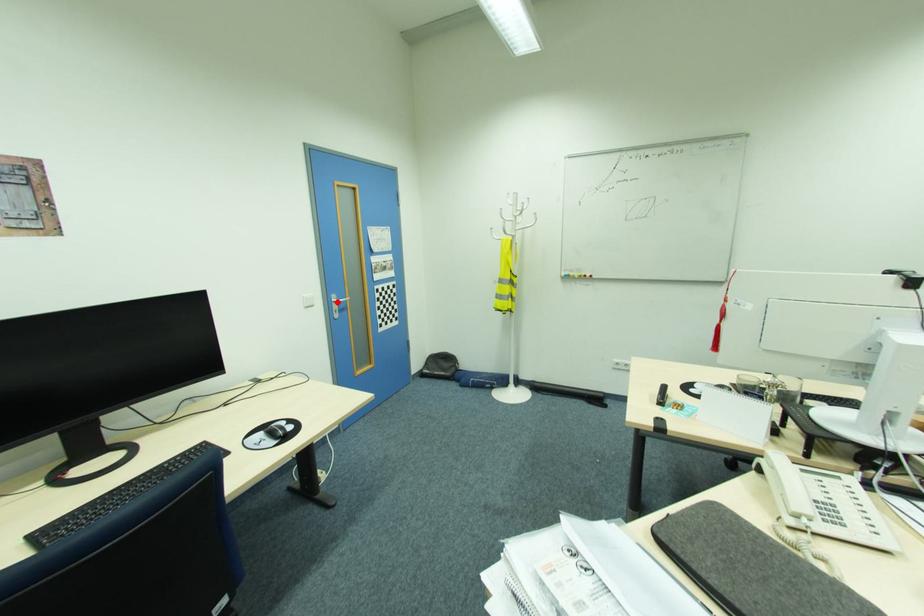
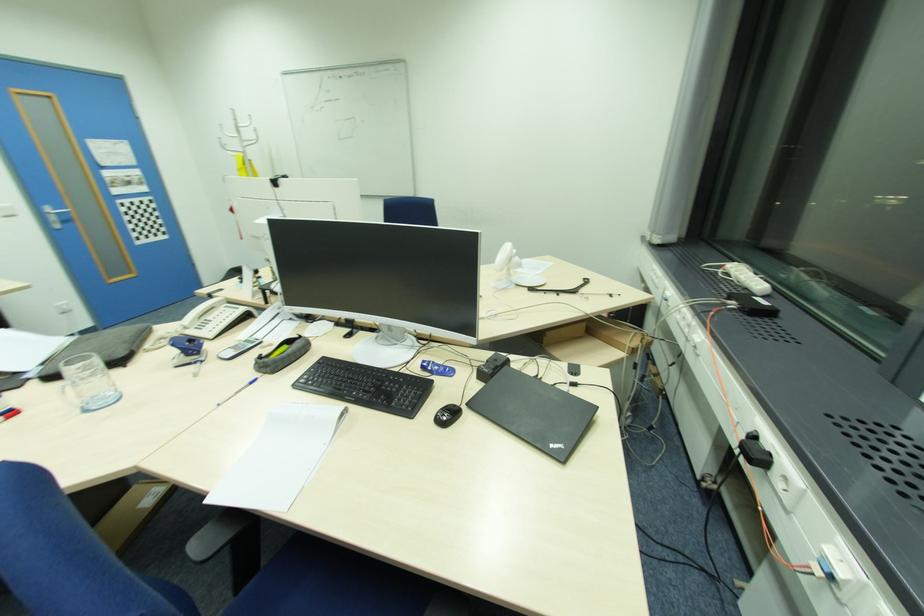
Locate, in the second image, the point that corresponds to the highlighted location in the first image.

(54, 213)